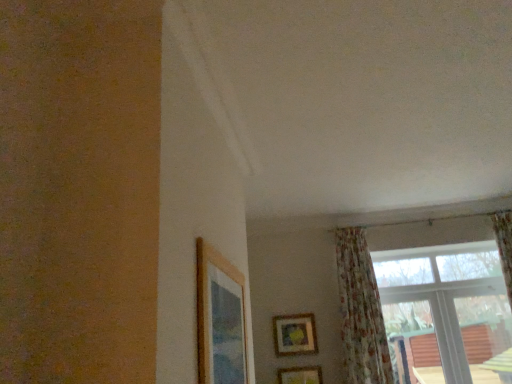
Question: Does wooden picture frame at upper center, positioned as the 2th picture frame in back-to-front order, come in front of wooden picture frame at upper left, which ranks as the first picture frame in front-to-back order?

Choices:
 (A) no
 (B) yes

Answer: (A)

Question: Can you confirm if wooden picture frame at upper center, the first picture frame ordered from the bottom, is bigger than wooden picture frame at upper left, which ranks as the first picture frame in front-to-back order?

Choices:
 (A) yes
 (B) no

Answer: (B)

Question: From a real-world perspective, is wooden picture frame at upper center, the 2th picture frame when ordered from front to back, on wooden picture frame at upper left, which ranks as the 3th picture frame in back-to-front order?

Choices:
 (A) no
 (B) yes

Answer: (A)

Question: From the image's perspective, is wooden picture frame at upper center, marked as the 3th picture frame in a top-to-bottom arrangement, beneath wooden picture frame at upper left, the first picture frame in the left-to-right sequence?

Choices:
 (A) yes
 (B) no

Answer: (A)

Question: From the image's perspective, is wooden picture frame at upper center, the 3th picture frame when ordered from left to right, over wooden picture frame at upper left, which ranks as the 3th picture frame in back-to-front order?

Choices:
 (A) yes
 (B) no

Answer: (B)

Question: Is wooden picture frame at upper center, the first picture frame ordered from the bottom, shorter than wooden picture frame at upper left, which appears as the first picture frame when viewed from the top?

Choices:
 (A) yes
 (B) no

Answer: (A)

Question: From the image's perspective, is wooden picture frame at upper left, arranged as the third picture frame when ordered from the bottom, beneath wooden picture frame at lower center, which is counted as the second picture frame, starting from the right?

Choices:
 (A) no
 (B) yes

Answer: (A)

Question: Considering the relative sizes of wooden picture frame at upper left, which ranks as the 3th picture frame in back-to-front order, and wooden picture frame at lower center, which is the 2th picture frame from left to right, in the image provided, is wooden picture frame at upper left, which ranks as the 3th picture frame in back-to-front order, smaller than wooden picture frame at lower center, which is the 2th picture frame from left to right,?

Choices:
 (A) no
 (B) yes

Answer: (A)

Question: Are wooden picture frame at upper left, which appears as the first picture frame when viewed from the top, and wooden picture frame at lower center, which is counted as the second picture frame, starting from the top, beside each other?

Choices:
 (A) no
 (B) yes

Answer: (A)

Question: Is wooden picture frame at upper left, marked as the third picture frame in a right-to-left arrangement, facing away from wooden picture frame at lower center, which is counted as the second picture frame, starting from the top?

Choices:
 (A) no
 (B) yes

Answer: (A)

Question: Would you say wooden picture frame at upper left, which ranks as the 3th picture frame in back-to-front order, is outside wooden picture frame at lower center, arranged as the 1th picture frame when viewed from the back?

Choices:
 (A) no
 (B) yes

Answer: (B)

Question: Does wooden picture frame at upper left, marked as the third picture frame in a right-to-left arrangement, have a larger size compared to wooden picture frame at lower center, which is the 2th picture frame from left to right?

Choices:
 (A) yes
 (B) no

Answer: (A)

Question: Is wooden picture frame at upper center, positioned as the 1th picture frame in right-to-left order, bigger than floral fabric curtain at lower right?

Choices:
 (A) no
 (B) yes

Answer: (A)